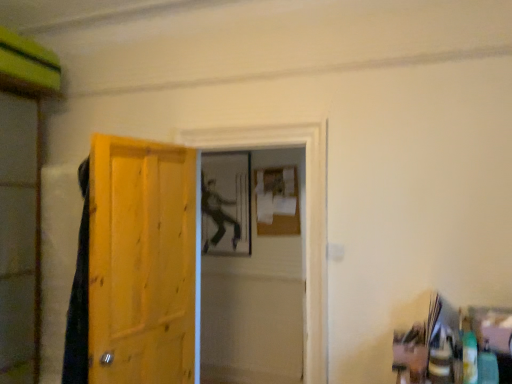
Question: Considering the relative positions of wooden door at left and transparent plastic screen door at left, placed as the 2th screen door when sorted from right to left, in the image provided, is wooden door at left to the left or to the right of transparent plastic screen door at left, placed as the 2th screen door when sorted from right to left,?

Choices:
 (A) left
 (B) right

Answer: (B)

Question: Considering the positions of point (146, 359) and point (33, 165), is point (146, 359) closer or farther from the camera than point (33, 165)?

Choices:
 (A) farther
 (B) closer

Answer: (B)

Question: Which of these objects is positioned closest to the wooden door at left?

Choices:
 (A) matte black figure at center
 (B) transparent plastic screen door at left, positioned as the 1th screen door in left-to-right order
 (C) matte wooden screen door at center, which is the 1th screen door from right to left

Answer: (B)

Question: Estimate the real-world distances between objects in this image. Which object is closer to the matte wooden screen door at center, which is the 1th screen door from right to left?

Choices:
 (A) wooden door at left
 (B) matte black figure at center
 (C) transparent plastic screen door at left, positioned as the 1th screen door in left-to-right order

Answer: (B)